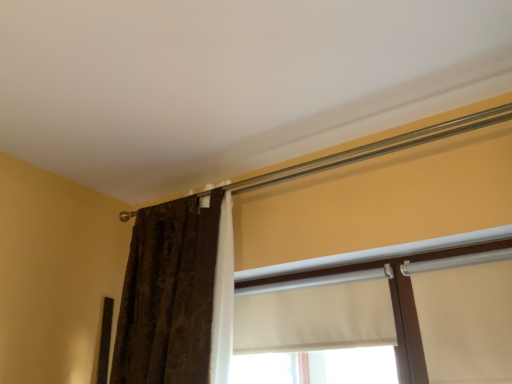
Question: Is white fabric at center, the second window positioned from the left, located outside white matte window at center, which is counted as the second window, starting from the right?

Choices:
 (A) yes
 (B) no

Answer: (A)

Question: Can you confirm if white fabric at center, the second window positioned from the left, is shorter than white matte window at center, which is counted as the second window, starting from the right?

Choices:
 (A) no
 (B) yes

Answer: (A)

Question: From a real-world perspective, is white fabric at center, the second window positioned from the left, positioned under white matte window at center, which is counted as the second window, starting from the right, based on gravity?

Choices:
 (A) no
 (B) yes

Answer: (B)

Question: Does white fabric at center, the second window positioned from the left, appear on the left side of white matte window at center, marked as the 1th window in a left-to-right arrangement?

Choices:
 (A) yes
 (B) no

Answer: (B)

Question: Are white fabric at center, the 1th window positioned from the right, and white matte window at center, which is counted as the second window, starting from the right, far apart?

Choices:
 (A) no
 (B) yes

Answer: (A)

Question: From a real-world perspective, is white fabric at center, the second window positioned from the left, physically located above or below white matte window at center, which is counted as the second window, starting from the right?

Choices:
 (A) above
 (B) below

Answer: (B)

Question: From the image's perspective, is white fabric at center, the second window positioned from the left, above or below white matte window at center, which is counted as the second window, starting from the right?

Choices:
 (A) above
 (B) below

Answer: (A)

Question: Considering the positions of point (439, 266) and point (311, 296), is point (439, 266) closer or farther from the camera than point (311, 296)?

Choices:
 (A) closer
 (B) farther

Answer: (A)

Question: Looking at their shapes, would you say white fabric at center, the second window positioned from the left, is wider or thinner than white matte window at center, marked as the 1th window in a left-to-right arrangement?

Choices:
 (A) thin
 (B) wide

Answer: (B)

Question: In terms of width, does white fabric at center, the 1th window positioned from the right, look wider or thinner when compared to brown textured curtain at left?

Choices:
 (A) wide
 (B) thin

Answer: (B)

Question: Considering their positions, is white fabric at center, the 1th window positioned from the right, located in front of or behind brown textured curtain at left?

Choices:
 (A) front
 (B) behind

Answer: (A)

Question: Considering the positions of white fabric at center, the 1th window positioned from the right, and brown textured curtain at left in the image, is white fabric at center, the 1th window positioned from the right, bigger or smaller than brown textured curtain at left?

Choices:
 (A) small
 (B) big

Answer: (A)

Question: Is white fabric at center, the second window positioned from the left, spatially inside brown textured curtain at left, or outside of it?

Choices:
 (A) inside
 (B) outside

Answer: (B)

Question: Considering their positions, is white matte window at center, marked as the 1th window in a left-to-right arrangement, located in front of or behind white fabric at center, the 1th window positioned from the right?

Choices:
 (A) front
 (B) behind

Answer: (B)

Question: Choose the correct answer: Is white matte window at center, marked as the 1th window in a left-to-right arrangement, inside white fabric at center, the 1th window positioned from the right, or outside it?

Choices:
 (A) inside
 (B) outside

Answer: (A)